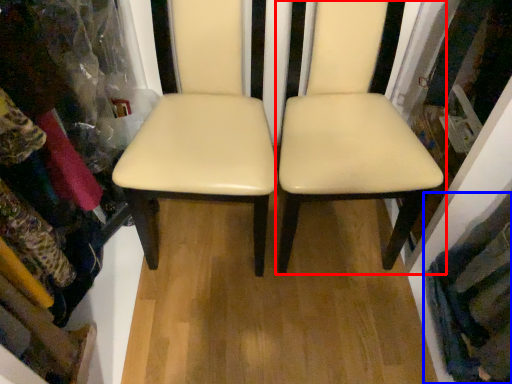
Question: Which object is closer to the camera taking this photo, chair (highlighted by a red box) or clothing (highlighted by a blue box)?

Choices:
 (A) chair
 (B) clothing

Answer: (A)